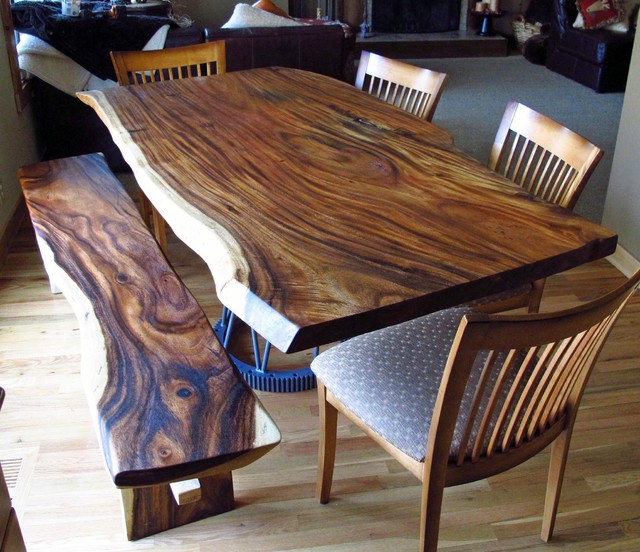
Locate an element on the screen. The image size is (640, 552). side faces of tabletop is located at coordinates (159, 200), (363, 320).